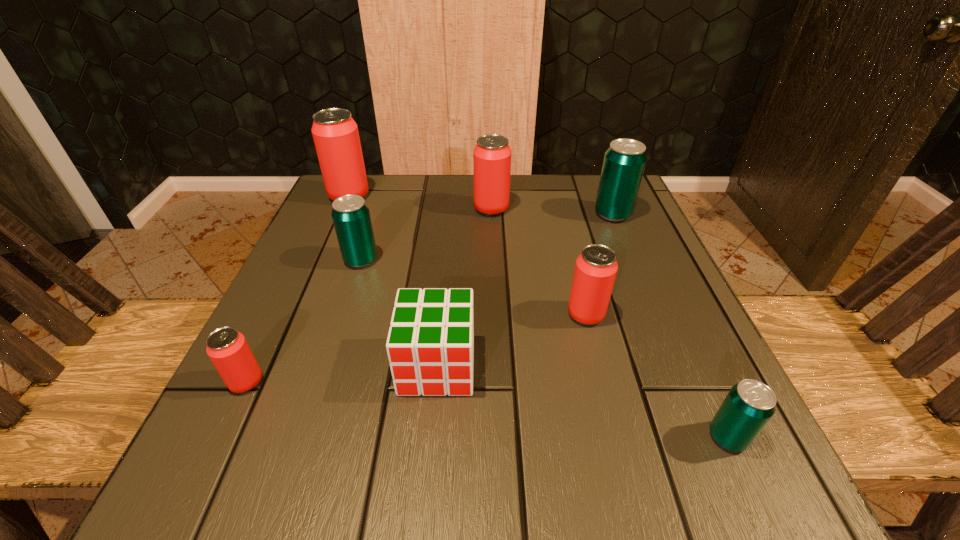
Identify the location of object that is the seventh closest to the second smallest teal beer can. (750, 404).

Locate which beer can ranks third in proximity to the third red beer can from left to right. Please provide its 2D coordinates. Your answer should be formatted as a tuple, i.e. [(x, y)], where the tuple contains the x and y coordinates of a point satisfying the conditions above.

[(335, 133)]

Find the location of a particular element. beer can that is the sixth closest to the third object from right to left is located at coordinates (335, 133).

The height and width of the screenshot is (540, 960). What are the coordinates of `the closest red beer can relative to the rightmost red beer can` in the screenshot? It's located at (492, 155).

Locate an element on the screen. the second closest red beer can relative to the tallest beer can is located at coordinates (227, 348).

Locate which teal beer can is the closest to the nearest object. Please provide its 2D coordinates. Your answer should be formatted as a tuple, i.e. [(x, y)], where the tuple contains the x and y coordinates of a point satisfying the conditions above.

[(624, 161)]

Select which teal beer can is the third closest to the tallest beer can. Please provide its 2D coordinates. Your answer should be formatted as a tuple, i.e. [(x, y)], where the tuple contains the x and y coordinates of a point satisfying the conditions above.

[(750, 404)]